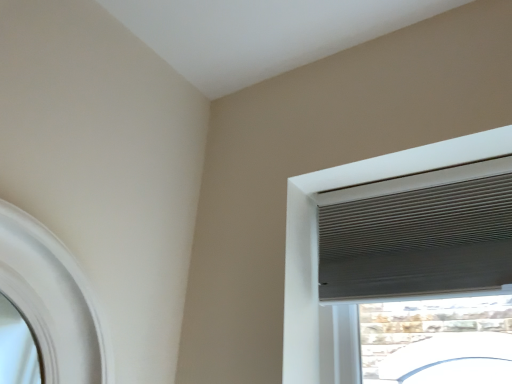
Identify the location of gray matte blind at upper right. pos(418,241).

Describe the element at coordinates (418, 241) in the screenshot. I see `gray matte blind at upper right` at that location.

Find the location of `gray matte blind at upper right`. gray matte blind at upper right is located at coordinates (418, 241).